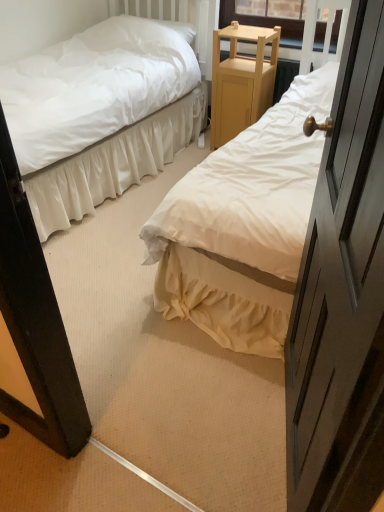
Question: Is white soft pillow at upper left further to the viewer compared to white cotton bed at center, the 2th bed positioned from the left?

Choices:
 (A) no
 (B) yes

Answer: (B)

Question: Can you confirm if white soft pillow at upper left is taller than white cotton bed at center, the 2th bed positioned from the left?

Choices:
 (A) yes
 (B) no

Answer: (B)

Question: Can you confirm if white soft pillow at upper left is thinner than white cotton bed at center, arranged as the 1th bed when viewed from the right?

Choices:
 (A) yes
 (B) no

Answer: (A)

Question: From a real-world perspective, is white soft pillow at upper left below white cotton bed at center, the 2th bed positioned from the left?

Choices:
 (A) yes
 (B) no

Answer: (B)

Question: Does white soft pillow at upper left have a larger size compared to white cotton bed at center, the 2th bed positioned from the left?

Choices:
 (A) yes
 (B) no

Answer: (B)

Question: Can we say white soft pillow at upper left lies outside white cotton bed at center, the 2th bed positioned from the left?

Choices:
 (A) no
 (B) yes

Answer: (B)

Question: Can you confirm if white soft pillow at upper left is bigger than light wood/finely crafted nightstand at center?

Choices:
 (A) yes
 (B) no

Answer: (B)

Question: From the image's perspective, does white soft pillow at upper left appear higher than light wood/finely crafted nightstand at center?

Choices:
 (A) no
 (B) yes

Answer: (B)

Question: Does white soft pillow at upper left touch light wood/finely crafted nightstand at center?

Choices:
 (A) no
 (B) yes

Answer: (A)

Question: From a real-world perspective, does white soft pillow at upper left sit lower than light wood/finely crafted nightstand at center?

Choices:
 (A) no
 (B) yes

Answer: (A)

Question: Can we say white soft pillow at upper left lies outside light wood/finely crafted nightstand at center?

Choices:
 (A) no
 (B) yes

Answer: (B)

Question: From a real-world perspective, is white soft pillow at upper left physically above light wood/finely crafted nightstand at center?

Choices:
 (A) no
 (B) yes

Answer: (B)

Question: Can you confirm if white cotton bed at center, arranged as the 1th bed when viewed from the right, is positioned to the right of white satin bed at center, the 2th bed when ordered from right to left?

Choices:
 (A) no
 (B) yes

Answer: (B)